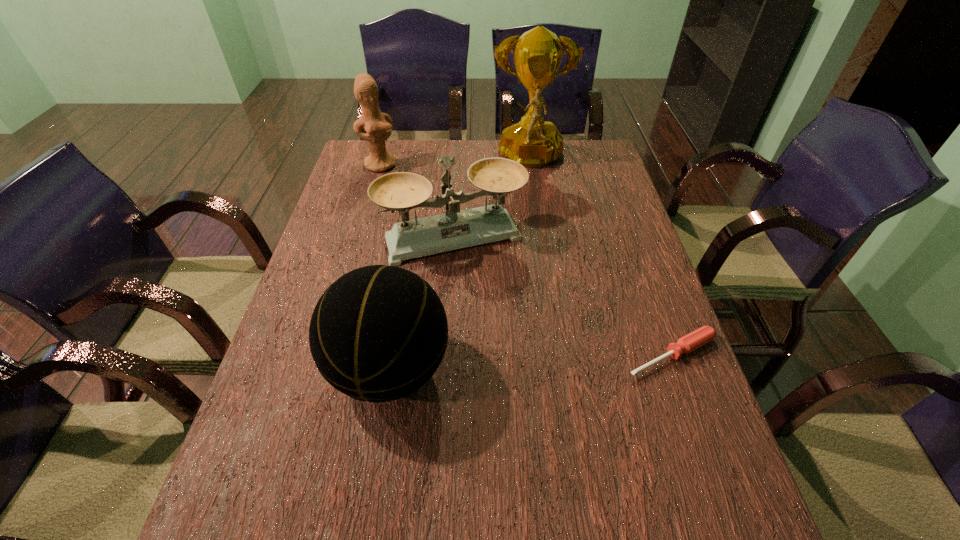
Locate an element on the screen. The width and height of the screenshot is (960, 540). free space at the far right corner of the desktop is located at coordinates (592, 148).

Identify the location of vacant space in between the figurine and the rightmost object. The width and height of the screenshot is (960, 540). (526, 260).

I want to click on free space between the scale and the award, so click(492, 199).

Where is `vacant space that's between the third nearest object and the award`? This screenshot has height=540, width=960. vacant space that's between the third nearest object and the award is located at coordinates (492, 199).

Find the location of `free space that is in between the scale and the shortest object`. free space that is in between the scale and the shortest object is located at coordinates (563, 296).

This screenshot has width=960, height=540. I want to click on free space that is in between the rightmost object and the award, so click(601, 257).

Identify the location of object that ranks as the second closest to the third farthest object. (378, 333).

In order to click on object that can be found as the second closest to the basketball in this screenshot , I will do `click(694, 340)`.